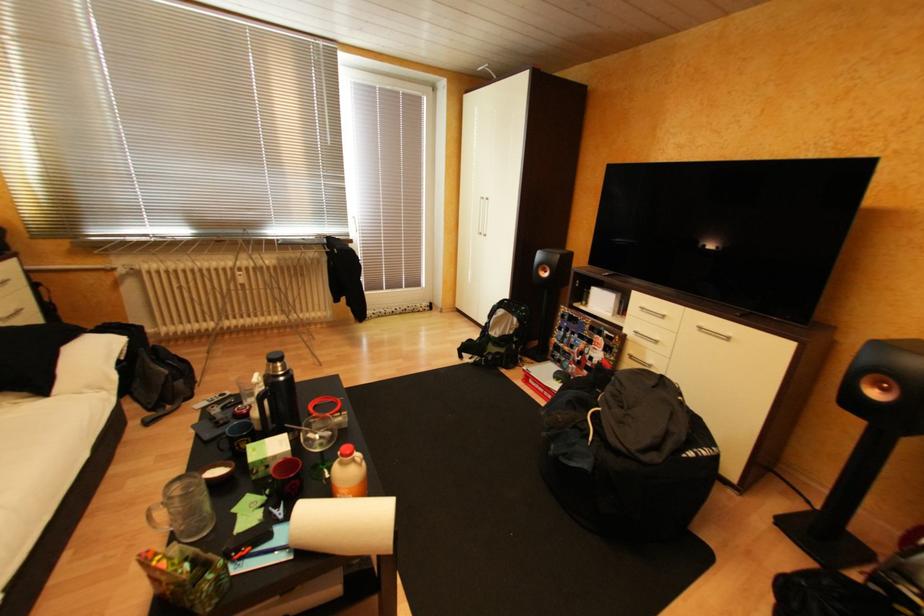
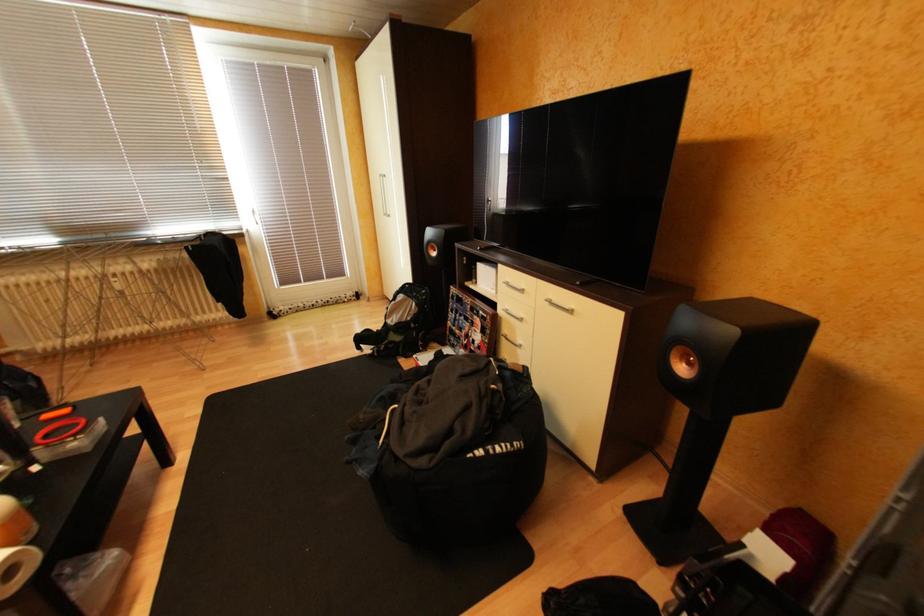
Question: What movement of the cameraman would produce the second image?

Choices:
 (A) Left
 (B) Right
 (C) Forward
 (D) Backward

Answer: (B)